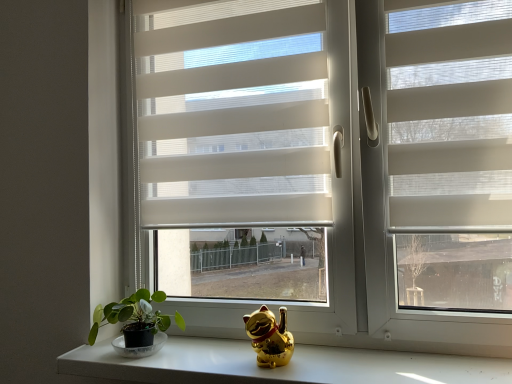
In order to click on vacant space behind gold shiny cat at center in this screenshot , I will do `click(249, 348)`.